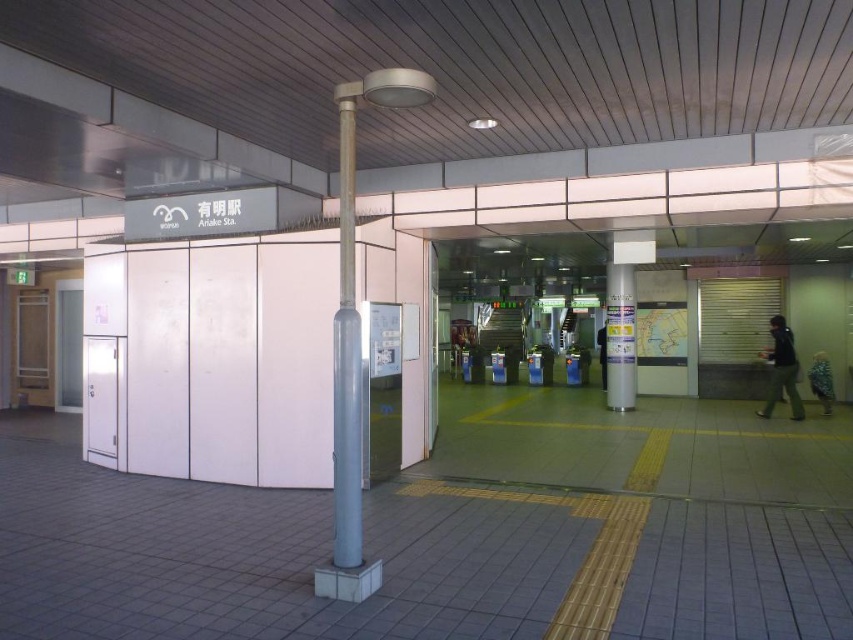
From the picture: Is dark gray fabric jacket at right thinner than blue patterned shirt at right?

In fact, dark gray fabric jacket at right might be wider than blue patterned shirt at right.

Looking at this image, can you confirm if dark gray fabric jacket at right is shorter than blue patterned shirt at right?

In fact, dark gray fabric jacket at right may be taller than blue patterned shirt at right.

Which is in front, point (775, 369) or point (833, 396)?

Point (775, 369)

Identify the location of dark gray fabric jacket at right. (782, 369).

Who is more forward, (627, 291) or (788, 387)?

Positioned in front is point (788, 387).

Looking at this image, is white glossy pillar at center further to camera compared to dark gray fabric jacket at right?

Yes.

Between point (618, 272) and point (790, 355), which one is positioned in front?

Point (790, 355)

In order to click on white glossy pillar at center in this screenshot , I will do `click(619, 337)`.

Does white glossy pillar at center appear on the right side of blue patterned shirt at right?

In fact, white glossy pillar at center is to the left of blue patterned shirt at right.

Where is `white glossy pillar at center`? white glossy pillar at center is located at coordinates point(619,337).

What do you see at coordinates (619, 337) in the screenshot? I see `white glossy pillar at center` at bounding box center [619, 337].

Where is `white glossy pillar at center`? white glossy pillar at center is located at coordinates (619, 337).